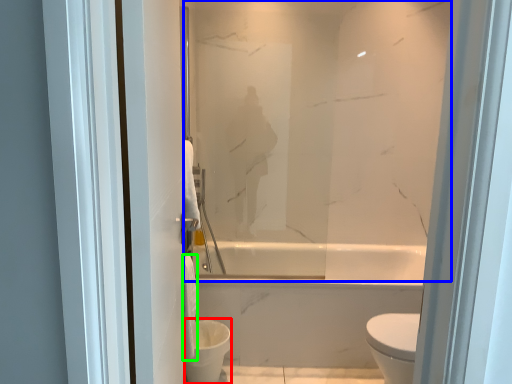
Question: Based on their relative distances, which object is farther from toilet bowl (highlighted by a red box)? Choose from mirror (highlighted by a blue box) and toilet paper (highlighted by a green box).

Choices:
 (A) mirror
 (B) toilet paper

Answer: (A)